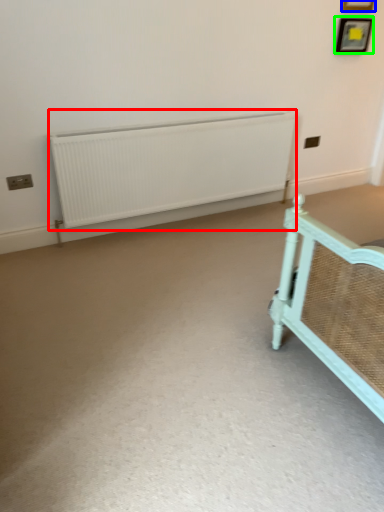
Question: Which object is the farthest from radiator (highlighted by a red box)? Choose among these: picture frame (highlighted by a blue box) or picture frame (highlighted by a green box).

Choices:
 (A) picture frame
 (B) picture frame

Answer: (A)